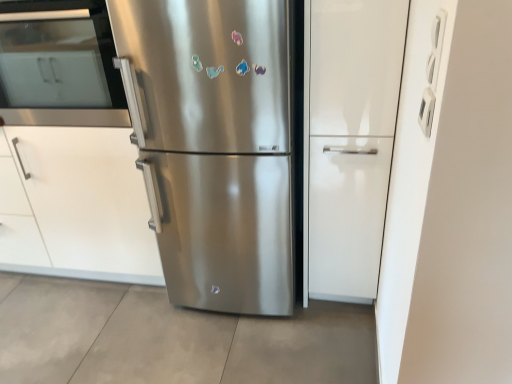
Question: Relative to white matte cabinet at left, is stainless steel refrigerator at center in front or behind?

Choices:
 (A) front
 (B) behind

Answer: (A)

Question: Considering the relative positions of stainless steel refrigerator at center and white matte cabinet at left in the image provided, is stainless steel refrigerator at center to the left or to the right of white matte cabinet at left?

Choices:
 (A) left
 (B) right

Answer: (B)

Question: Which of these objects is positioned farthest from the stainless steel refrigerator at center?

Choices:
 (A) stainless steel oven at left
 (B) white matte cabinet at left
 (C) white glossy cabinet at center

Answer: (A)

Question: Considering the real-world distances, which object is farthest from the stainless steel refrigerator at center?

Choices:
 (A) white matte cabinet at left
 (B) stainless steel oven at left
 (C) white glossy cabinet at center

Answer: (B)